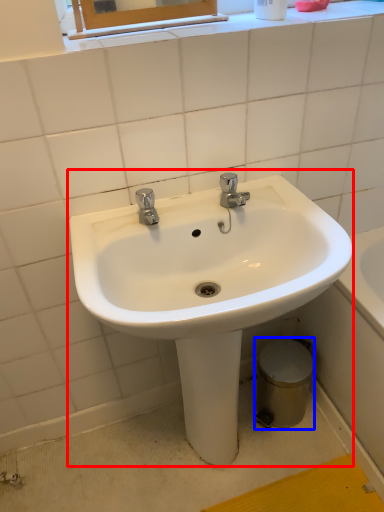
Question: Among these objects, which one is nearest to the camera, sink (highlighted by a red box) or bidet (highlighted by a blue box)?

Choices:
 (A) sink
 (B) bidet

Answer: (A)